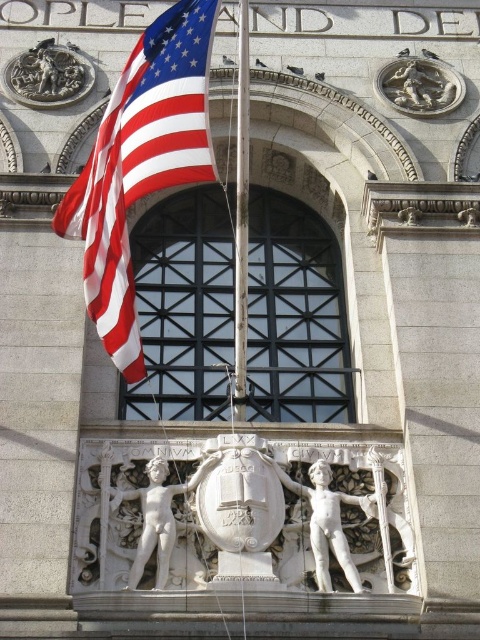
You are standing in front of the building and notice both the metallic pole at center and the silver metallic lion at upper right. Which object is positioned higher up on the building?

The silver metallic lion at upper right is positioned higher up on the building than the metallic pole at center.

You are standing in front of the building and notice two points marked on the facade. The first point is at coordinate point (237,128) and the second is at point (417,86). Which point is closer to you?

Point (237,128) is closer to the viewer than point (417,86).